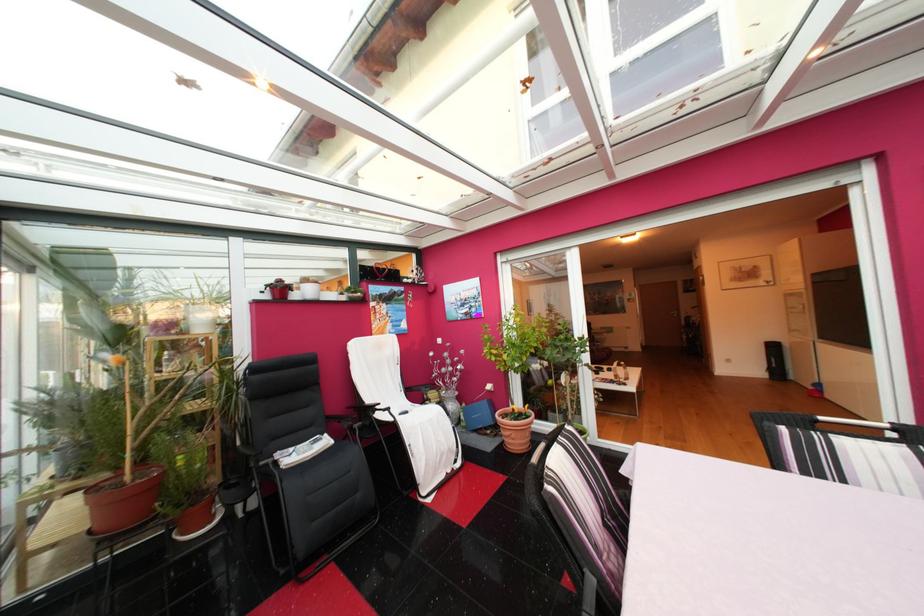
Locate an element on the screen. The image size is (924, 616). silver decorative vase is located at coordinates (450, 403).